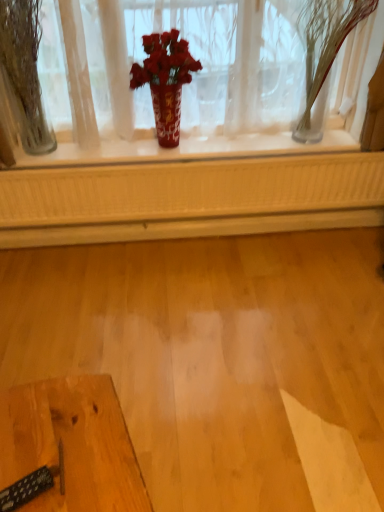
Question: Is red glossy vase at center to the left or to the right of clear glass vase at left, which ranks as the second tree in right-to-left order, in the image?

Choices:
 (A) right
 (B) left

Answer: (A)

Question: From the image's perspective, relative to clear glass vase at left, which is the 1th tree from left to right, is red glossy vase at center above or below?

Choices:
 (A) below
 (B) above

Answer: (B)

Question: Considering the real-world distances, which object is closest to the wooden table at lower left?

Choices:
 (A) clear glass vase at upper right, acting as the 2th tree starting from the left
 (B) red glossy vase at center
 (C) clear glass vase at left, which is the 1th tree from left to right

Answer: (C)

Question: Which object is positioned closest to the wooden table at lower left?

Choices:
 (A) clear glass vase at left, which ranks as the second tree in right-to-left order
 (B) red glossy vase at center
 (C) clear glass vase at upper right, acting as the 2th tree starting from the left

Answer: (A)